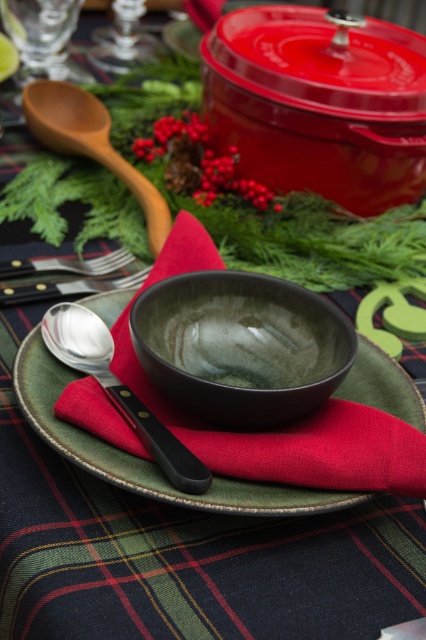
Question: Which object is farther from the camera taking this photo?

Choices:
 (A) silver metallic spoon at center
 (B) silver metallic fork at lower left
 (C) green matte bowl at center

Answer: (B)

Question: Can you confirm if wooden spoon at upper left is positioned to the right of silver metallic fork at lower left?

Choices:
 (A) yes
 (B) no

Answer: (A)

Question: Which of these objects is positioned farthest from the green matte bowl at center?

Choices:
 (A) silver metallic fork at lower left
 (B) silver metallic spoon at center

Answer: (A)

Question: Which point is farther to the camera?

Choices:
 (A) (49, 136)
 (B) (31, 284)

Answer: (A)

Question: Does green matte bowl at center have a lesser width compared to wooden spoon at upper left?

Choices:
 (A) no
 (B) yes

Answer: (A)

Question: Does green matte bowl at center lie in front of silver metallic spoon at center?

Choices:
 (A) no
 (B) yes

Answer: (B)